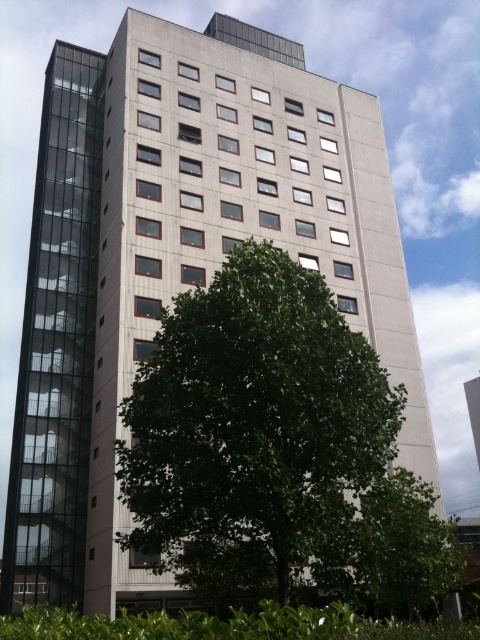
You are a landscape architect planning to install a new pathway between the green leafy tree at center and the green leafy hedge at lower center. The pathway requires a minimum of 4 meters of space between the two plants to ensure proper growth. Based on the current distance, will this spacing requirement be met?

The green leafy tree at center is 3.71 meters away from the green leafy hedge at lower center. Since the required minimum spacing is 4 meters, the current distance of 3.71 meters is insufficient. The pathway cannot be installed as planned without moving one of the plants.

You are standing in front of the building and want to take a photo. You notice two points marked on the building facade. Which point, point (x=132, y=515) or point (x=74, y=618), is closer to your camera lens?

Point (x=132, y=515) is further to the camera than point (x=74, y=618), so the point closer to the camera lens is point (x=74, y=618).

You are a gardener looking at the building and its surroundings. You need to trim both the green leafy tree at center and the green leafy hedge at lower center. Which one should you approach first to start trimming?

You should start trimming the green leafy hedge at lower center first because it is closer to you than the green leafy tree at center, which is further away.